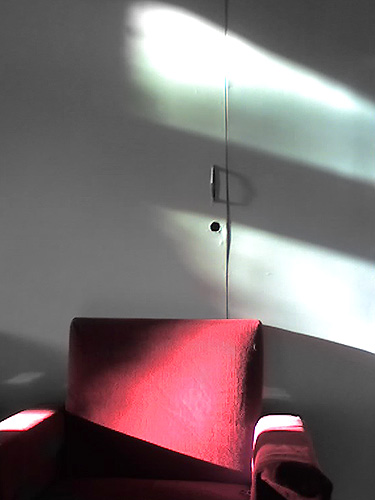
The width and height of the screenshot is (375, 500). I want to click on light cast on chair, so click(25, 420), click(164, 385), click(280, 425).